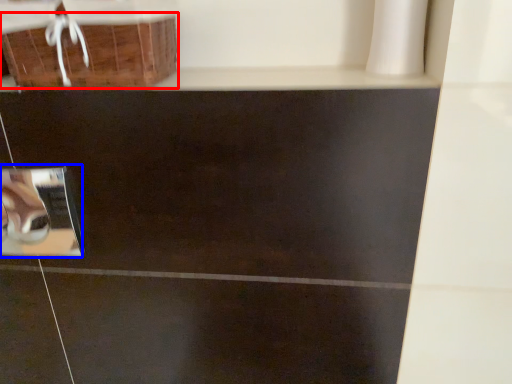
Question: Which of the following is the farthest to the observer, basket (highlighted by a red box) or square (highlighted by a blue box)?

Choices:
 (A) basket
 (B) square

Answer: (B)